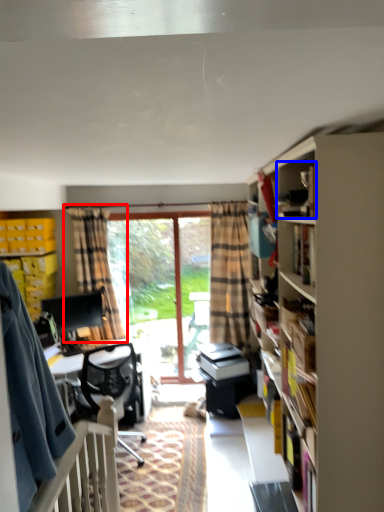
Question: Which of the following is the closest to the observer, curtain (highlighted by a red box) or book (highlighted by a blue box)?

Choices:
 (A) curtain
 (B) book

Answer: (B)